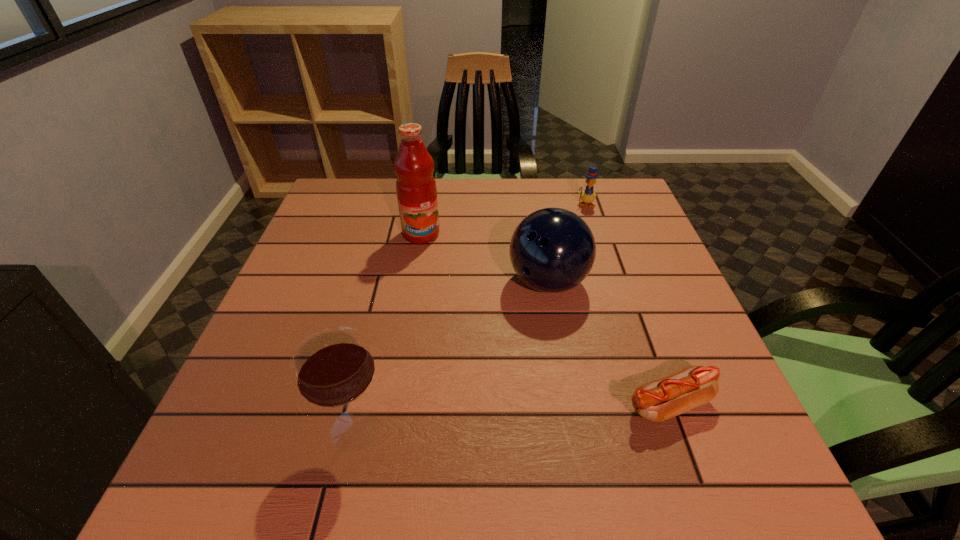
Where is `free location at the right edge of the desktop`? The width and height of the screenshot is (960, 540). free location at the right edge of the desktop is located at coordinates (670, 265).

Locate an element on the screen. This screenshot has width=960, height=540. vacant region at the far left corner of the desktop is located at coordinates (x=381, y=186).

In the image, there is a desktop. Find the location of `vacant area at the far right corner`. vacant area at the far right corner is located at coordinates (607, 214).

Locate an element on the screen. Image resolution: width=960 pixels, height=540 pixels. vacant space at the near right corner of the desktop is located at coordinates (728, 436).

In order to click on vacant area that lies between the second farthest object and the shortest object in this screenshot , I will do `click(544, 319)`.

Locate an element on the screen. The height and width of the screenshot is (540, 960). unoccupied position between the sausage and the wineglass is located at coordinates (512, 416).

Where is `free space between the fruit juice and the wineglass`? The width and height of the screenshot is (960, 540). free space between the fruit juice and the wineglass is located at coordinates (389, 331).

Identify the location of free space that is in between the wineglass and the fruit juice. This screenshot has height=540, width=960. (389, 331).

Find the location of a particular element. unoccupied area between the duckling and the wineglass is located at coordinates (470, 316).

Locate an element on the screen. Image resolution: width=960 pixels, height=540 pixels. vacant area that lies between the wineglass and the farthest object is located at coordinates (470, 316).